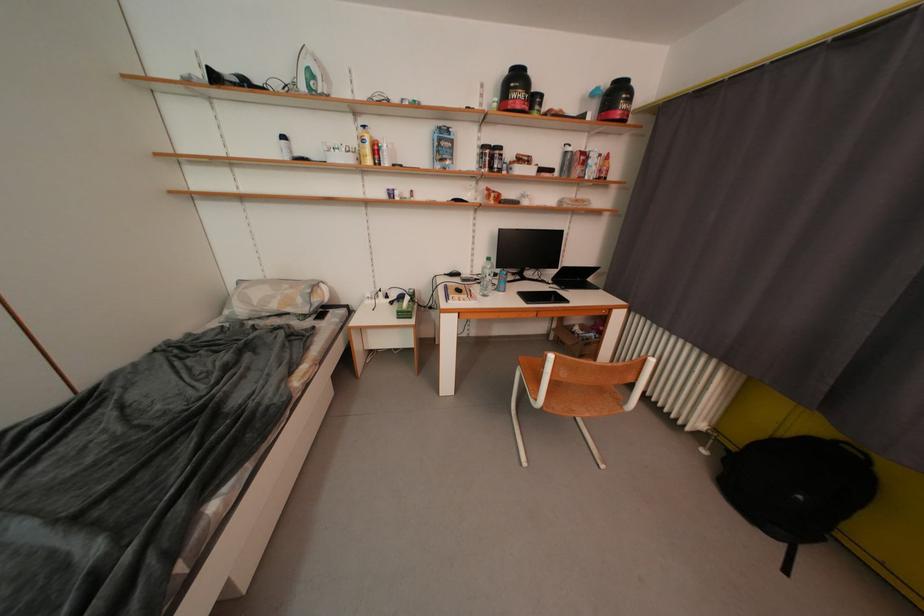
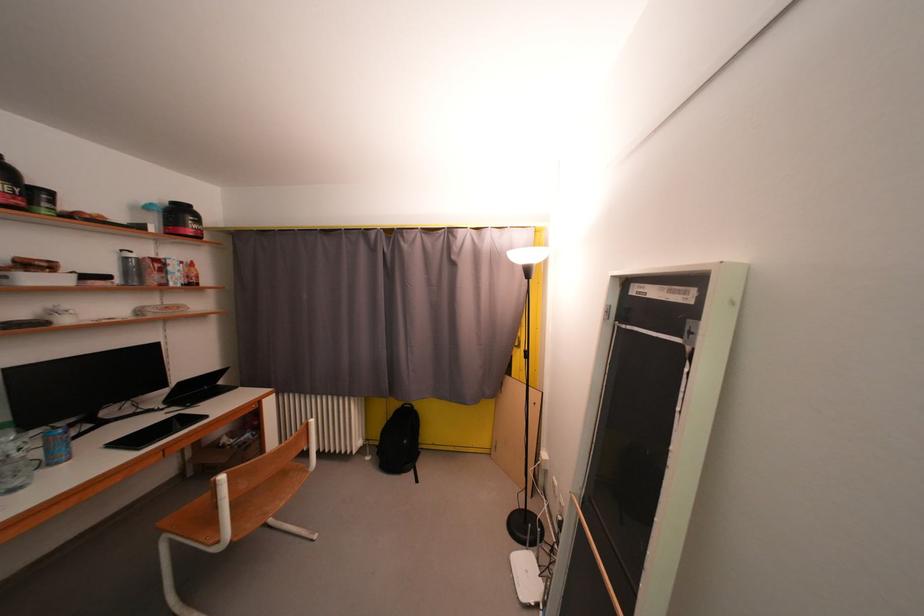
Find the pixel in the second image that matches (493,296) in the first image.

(25, 487)